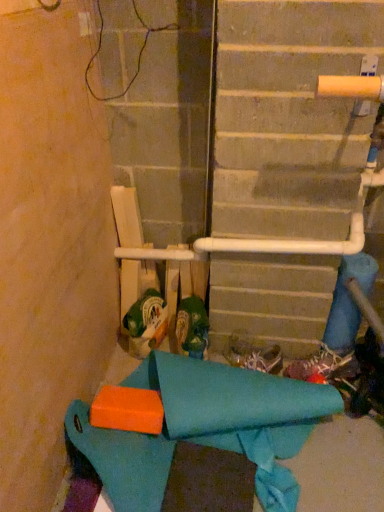
Question: Is the depth of white fabric shoe at center, the 2th footwear from the left, less than that of teal fabric at lower left?

Choices:
 (A) no
 (B) yes

Answer: (A)

Question: Is white fabric shoe at center, which is counted as the 2th footwear, starting from the right, bigger than teal fabric at lower left?

Choices:
 (A) yes
 (B) no

Answer: (B)

Question: Does white fabric shoe at center, which is counted as the 2th footwear, starting from the right, have a smaller size compared to teal fabric at lower left?

Choices:
 (A) no
 (B) yes

Answer: (B)

Question: Considering the relative sizes of white fabric shoe at center, the 2th footwear from the left, and teal fabric at lower left in the image provided, is white fabric shoe at center, the 2th footwear from the left, thinner than teal fabric at lower left?

Choices:
 (A) no
 (B) yes

Answer: (B)

Question: Could you tell me if white fabric shoe at center, the 2th footwear from the left, is facing teal fabric at lower left?

Choices:
 (A) yes
 (B) no

Answer: (A)

Question: Can you confirm if white fabric shoe at center, the 2th footwear from the left, is shorter than teal fabric at lower left?

Choices:
 (A) no
 (B) yes

Answer: (B)

Question: Is green fabric shoe at center, marked as the 1th footwear in a left-to-right arrangement, far from teal fabric at lower left?

Choices:
 (A) yes
 (B) no

Answer: (B)

Question: From the image's perspective, does green fabric shoe at center, marked as the 1th footwear in a left-to-right arrangement, appear higher than teal fabric at lower left?

Choices:
 (A) no
 (B) yes

Answer: (B)

Question: Is green fabric shoe at center, marked as the 1th footwear in a left-to-right arrangement, smaller than teal fabric at lower left?

Choices:
 (A) yes
 (B) no

Answer: (A)

Question: Considering the relative sizes of green fabric shoe at center, placed as the third footwear when sorted from right to left, and teal fabric at lower left in the image provided, is green fabric shoe at center, placed as the third footwear when sorted from right to left, bigger than teal fabric at lower left?

Choices:
 (A) no
 (B) yes

Answer: (A)

Question: Is green fabric shoe at center, marked as the 1th footwear in a left-to-right arrangement, at the left side of teal fabric at lower left?

Choices:
 (A) yes
 (B) no

Answer: (A)

Question: Does green fabric shoe at center, marked as the 1th footwear in a left-to-right arrangement, come behind teal fabric at lower left?

Choices:
 (A) yes
 (B) no

Answer: (A)

Question: Is white fabric shoe at center, which is counted as the 2th footwear, starting from the right, located outside green fabric shoe at center, placed as the third footwear when sorted from right to left?

Choices:
 (A) yes
 (B) no

Answer: (A)